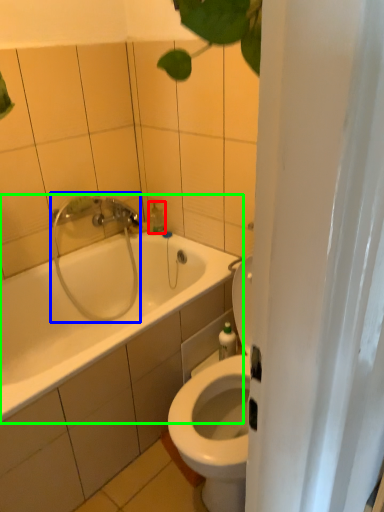
Question: Considering the real-world distances, which object is farthest from soap dispenser (highlighted by a red box)? shower (highlighted by a blue box) or bathtub (highlighted by a green box)?

Choices:
 (A) shower
 (B) bathtub

Answer: (B)